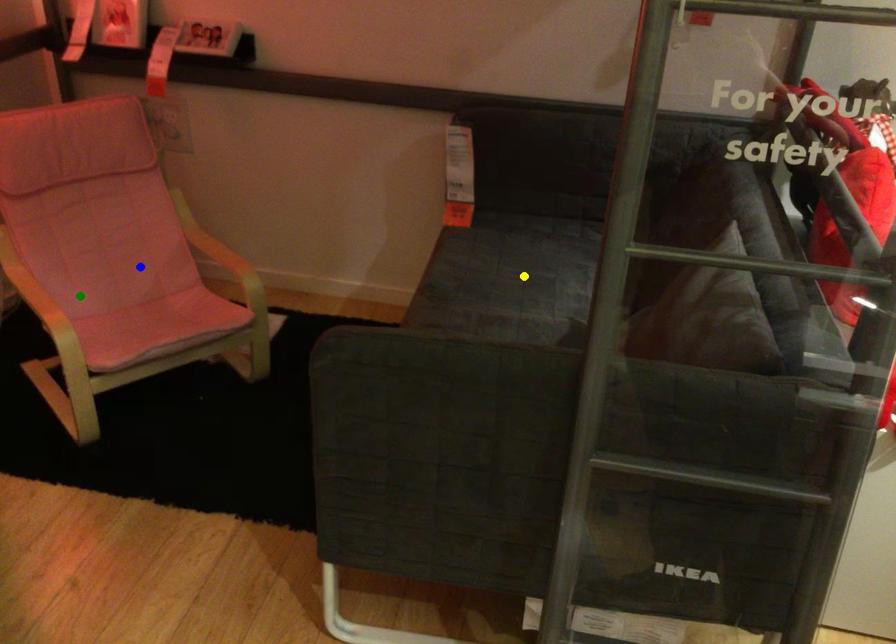
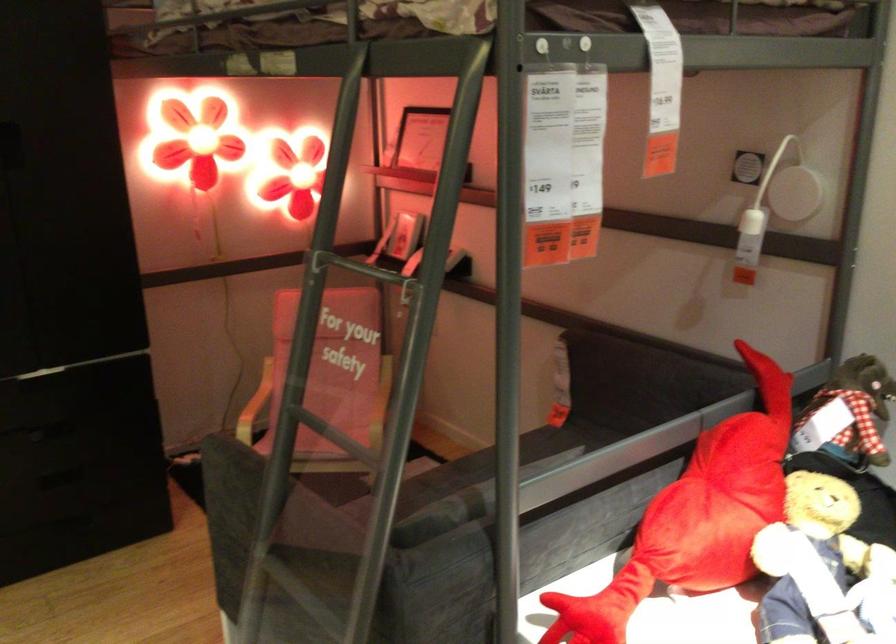
I am providing you with two images of the same scene from different viewpoints. Three points are marked in image1. Which point corresponds to a part or object that is occluded in image2?In image1, three points are marked. Which of them correspond to a part or object that is occluded in image2?Among the three points shown in image1, which one corresponds to a part or object that is no longer visible due to occlusion in image2?

Invisible in image2: yellow point.